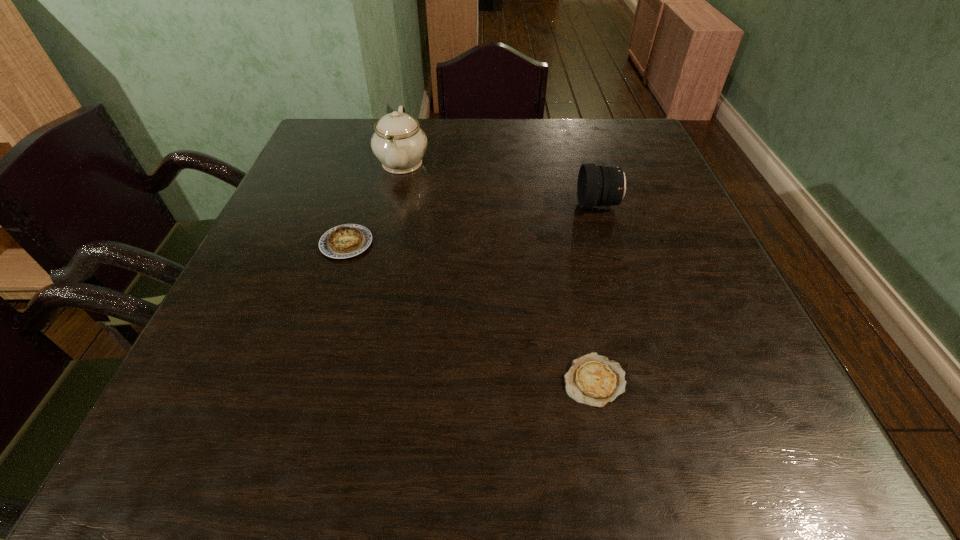
I want to click on free space located 0.230m at the front element of the second tallest object, so click(480, 205).

Identify the location of vacant space located at the front element of the second tallest object. (417, 205).

This screenshot has width=960, height=540. I want to click on vacant space located on the right of the taller quiche, so click(494, 244).

Find the location of `vacant space located on the front of the right quiche`. vacant space located on the front of the right quiche is located at coordinates (612, 461).

The width and height of the screenshot is (960, 540). I want to click on object located in the far edge section of the desktop, so click(x=398, y=142).

This screenshot has width=960, height=540. Find the location of `object at the left edge`. object at the left edge is located at coordinates (344, 241).

Where is `object located at the right edge`? The width and height of the screenshot is (960, 540). object located at the right edge is located at coordinates (599, 186).

I want to click on free point at the far edge, so click(562, 149).

Where is `free space at the near edge of the desktop`? The width and height of the screenshot is (960, 540). free space at the near edge of the desktop is located at coordinates (400, 478).

This screenshot has height=540, width=960. Identify the location of vacant space at the left edge of the desktop. (274, 207).